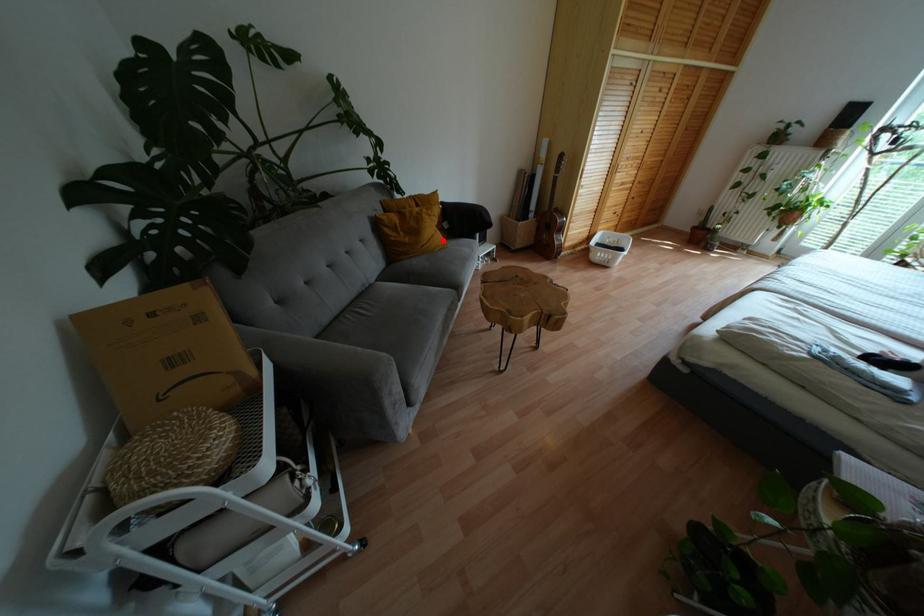
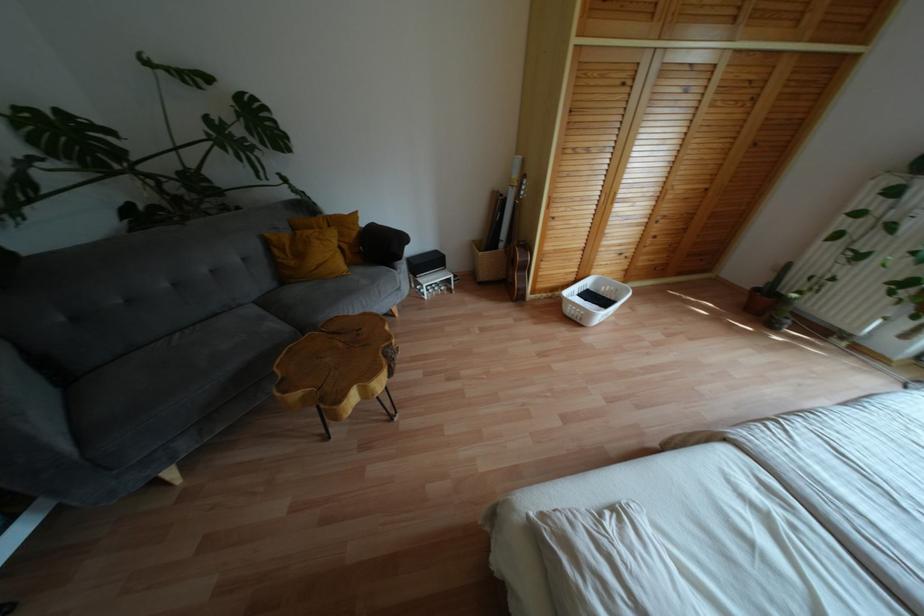
Locate, in the second image, the point that corresponds to the highlighted location in the first image.

(343, 267)